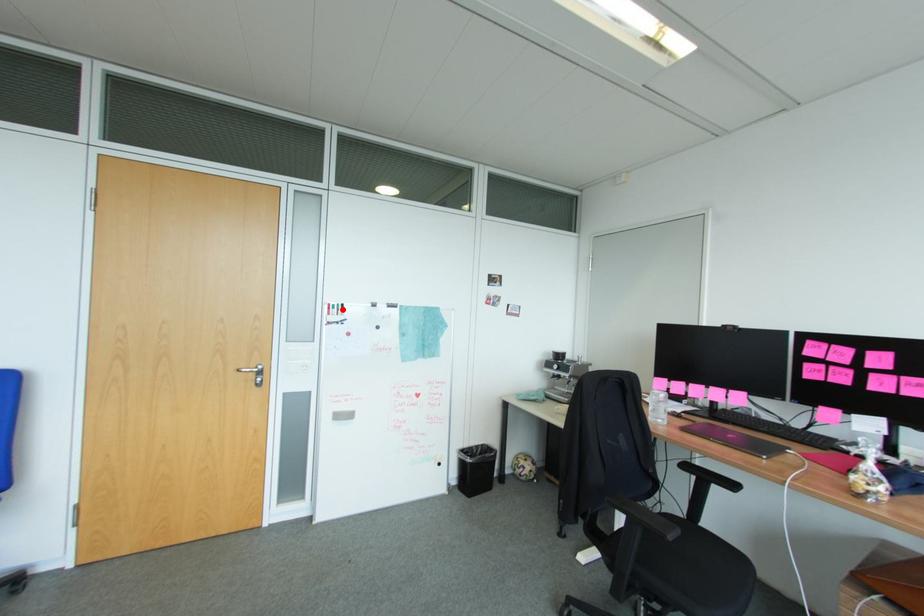
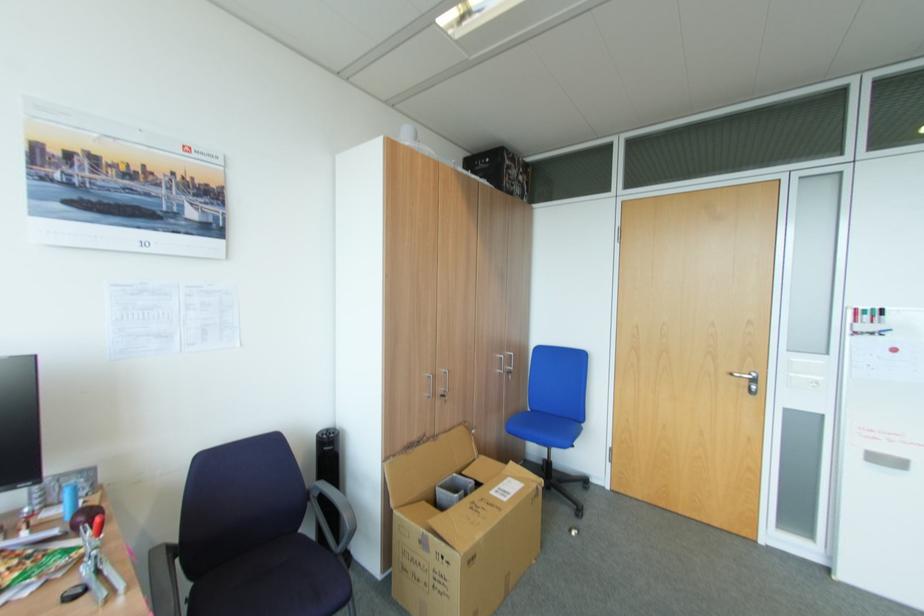
In the second image, find the point that corresponds to the highlighted location in the first image.

(880, 317)